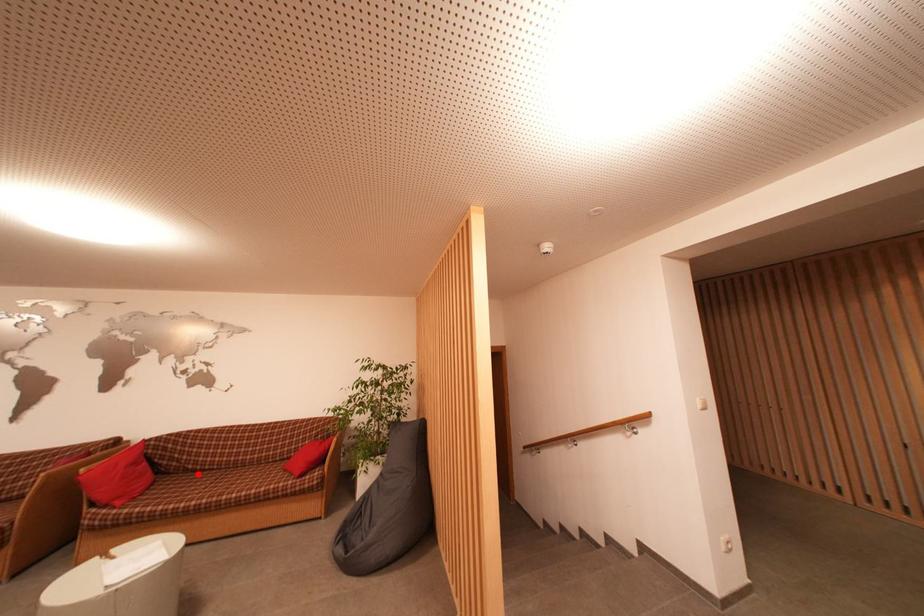
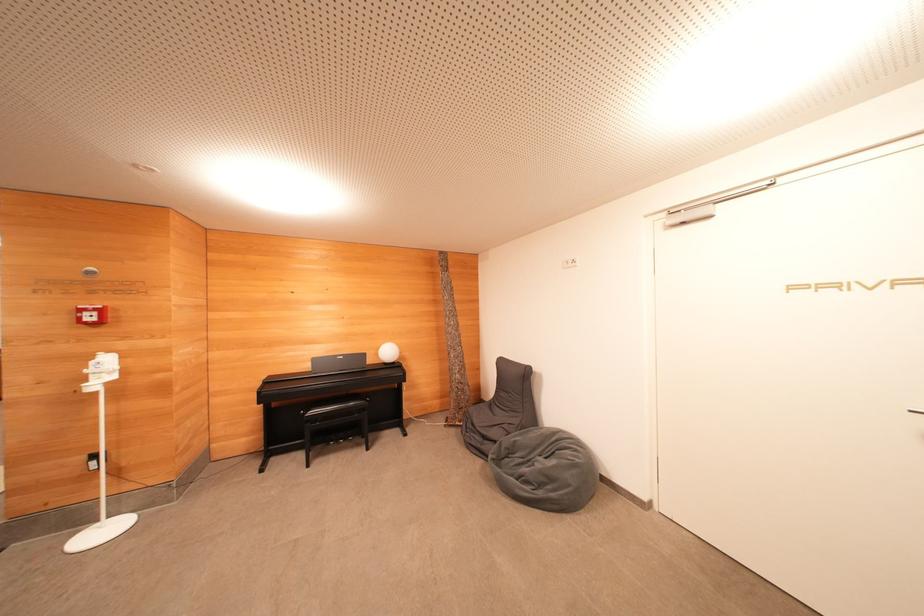
Question: I am providing you with two images of the same scene from different viewpoints. A red point is marked on the first image. Is the red point's position out of view in image 2?

Choices:
 (A) Yes
 (B) No

Answer: (A)